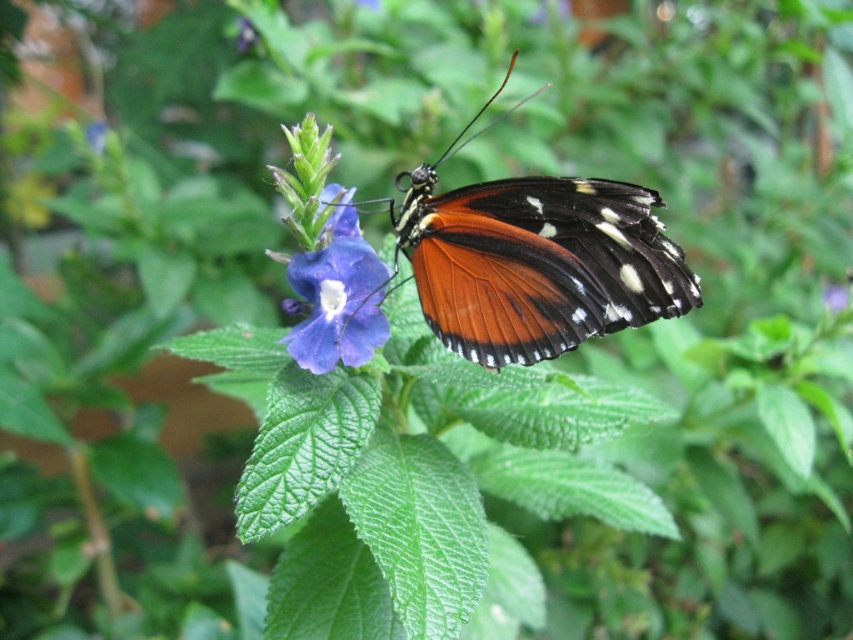
Question: Which object appears closest to the camera in this image?

Choices:
 (A) matte purple flower at center
 (B) orange matte butterfly at center

Answer: (B)

Question: Observing the image, what is the correct spatial positioning of orange matte butterfly at center in reference to matte purple flower at center?

Choices:
 (A) below
 (B) above

Answer: (A)

Question: Among these objects, which one is nearest to the camera?

Choices:
 (A) matte purple flower at center
 (B) orange matte butterfly at center

Answer: (B)

Question: Can you confirm if orange matte butterfly at center is positioned to the right of matte purple flower at center?

Choices:
 (A) yes
 (B) no

Answer: (A)

Question: Which of the following is the closest to the observer?

Choices:
 (A) tap(367, 276)
 (B) tap(469, 339)

Answer: (A)

Question: Is orange matte butterfly at center bigger than matte purple flower at center?

Choices:
 (A) yes
 (B) no

Answer: (A)